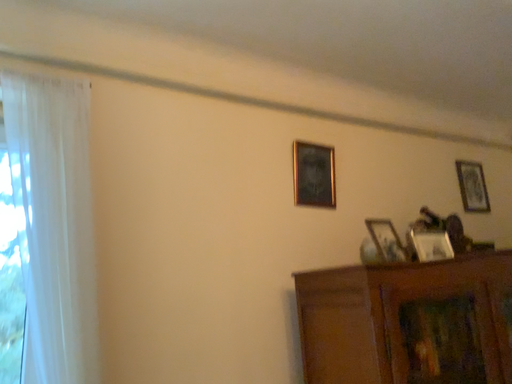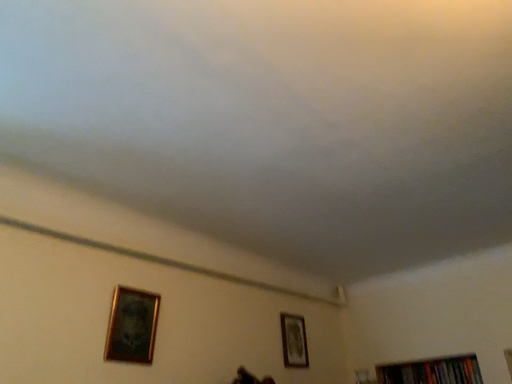
Question: How did the camera likely rotate when shooting the video?

Choices:
 (A) rotated downward
 (B) rotated upward

Answer: (B)